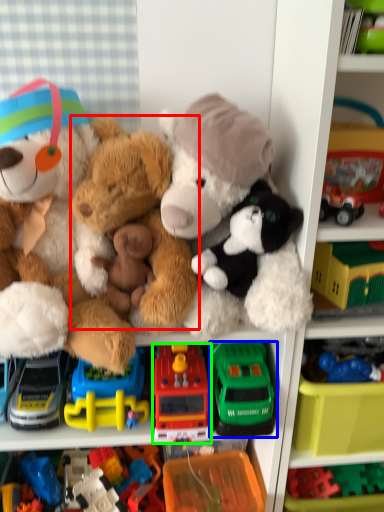
Question: Considering the real-world distances, which object is closest to teddy bear (highlighted by a red box)? toy (highlighted by a blue box) or toy (highlighted by a green box).

Choices:
 (A) toy
 (B) toy

Answer: (B)